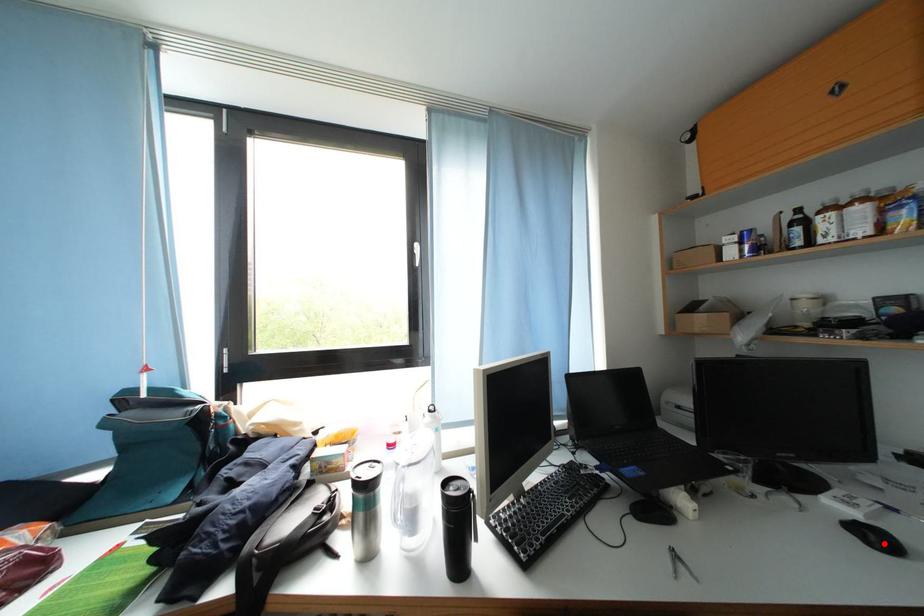
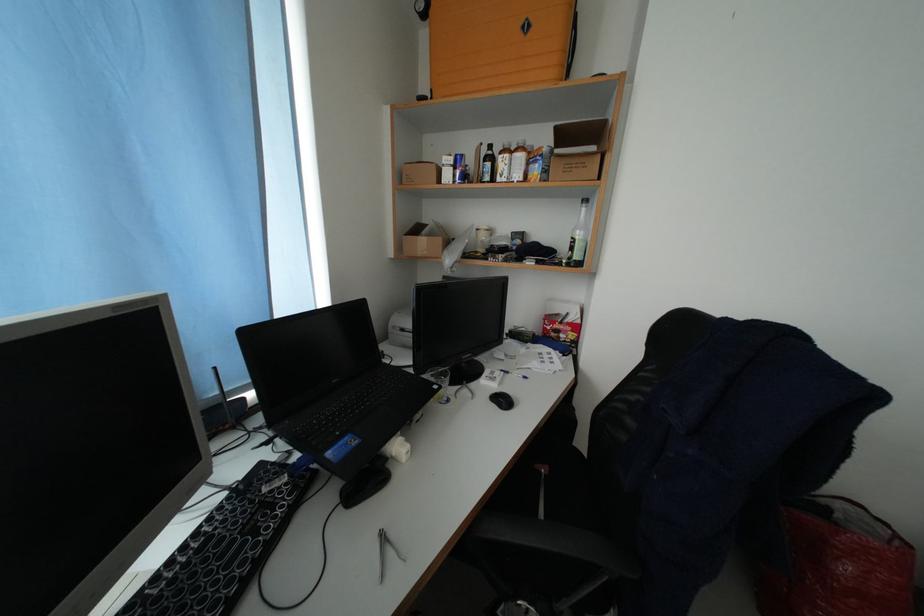
Question: I am providing you with two images of the same scene from different viewpoints. In image1, a red point is highlighted. Considering the same 3D point in image2, which of the following is correct?

Choices:
 (A) It is closer
 (B) It is farther

Answer: (B)